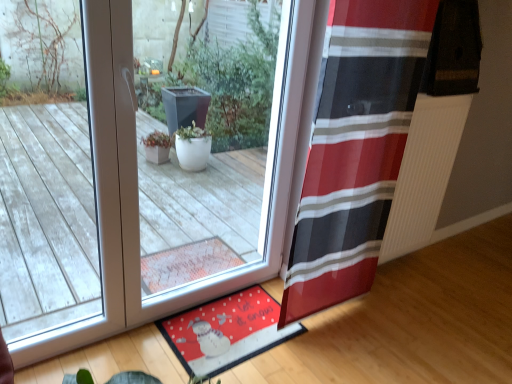
Question: Is transparent glass window at center thinner than red fabric mat at lower center?

Choices:
 (A) yes
 (B) no

Answer: (A)

Question: Does transparent glass window at center touch red fabric mat at lower center?

Choices:
 (A) no
 (B) yes

Answer: (A)

Question: Would you say red fabric mat at lower center is part of transparent glass window at center's contents?

Choices:
 (A) yes
 (B) no

Answer: (B)

Question: From a real-world perspective, does transparent glass window at center stand above red fabric mat at lower center?

Choices:
 (A) yes
 (B) no

Answer: (A)

Question: Considering the relative positions of transparent glass window at center and red fabric mat at lower center in the image provided, is transparent glass window at center to the left of red fabric mat at lower center from the viewer's perspective?

Choices:
 (A) yes
 (B) no

Answer: (A)

Question: Can you confirm if transparent glass window at center is taller than red fabric mat at lower center?

Choices:
 (A) no
 (B) yes

Answer: (B)

Question: Does transparent glass window at center lie in front of red striped curtain at right?

Choices:
 (A) no
 (B) yes

Answer: (B)

Question: Can you see transparent glass window at center touching red striped curtain at right?

Choices:
 (A) yes
 (B) no

Answer: (B)

Question: Can you confirm if transparent glass window at center is shorter than red striped curtain at right?

Choices:
 (A) no
 (B) yes

Answer: (B)

Question: Can we say transparent glass window at center lies outside red striped curtain at right?

Choices:
 (A) no
 (B) yes

Answer: (B)

Question: Does transparent glass window at center have a greater width compared to red striped curtain at right?

Choices:
 (A) no
 (B) yes

Answer: (B)

Question: From the image's perspective, is transparent glass window at center above red striped curtain at right?

Choices:
 (A) no
 (B) yes

Answer: (B)

Question: Is red fabric mat at lower center taller than transparent glass window at center?

Choices:
 (A) yes
 (B) no

Answer: (B)